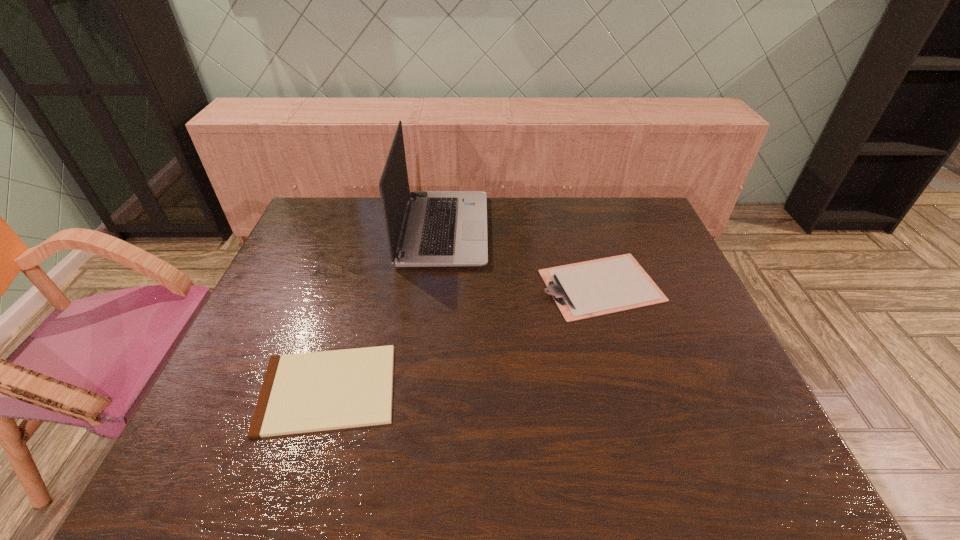
The image size is (960, 540). I want to click on empty location between the second shortest object and the laptop computer, so click(x=522, y=258).

Find the location of a particular element. vacant area between the laptop computer and the rightmost object is located at coordinates (522, 258).

This screenshot has width=960, height=540. I want to click on vacant area that lies between the tallest object and the second tallest object, so click(x=522, y=258).

Where is `free spot between the nearest object and the taller clipboard`? The height and width of the screenshot is (540, 960). free spot between the nearest object and the taller clipboard is located at coordinates (465, 337).

Locate an element on the screen. The height and width of the screenshot is (540, 960). free spot between the second tallest object and the left clipboard is located at coordinates (465, 337).

This screenshot has height=540, width=960. In order to click on empty space between the second tallest object and the laptop computer in this screenshot , I will do click(522, 258).

Where is `vacant space in between the farther clipboard and the tallest object`? This screenshot has width=960, height=540. vacant space in between the farther clipboard and the tallest object is located at coordinates 522,258.

At what (x,y) coordinates should I click in order to perform the action: click on free space that is in between the shorter clipboard and the tallest object. Please return your answer as a coordinate pair (x, y). Looking at the image, I should click on (386, 309).

Where is `free area in between the farther clipboard and the tallest object`? The height and width of the screenshot is (540, 960). free area in between the farther clipboard and the tallest object is located at coordinates (522, 258).

I want to click on empty location between the laptop computer and the right clipboard, so click(522, 258).